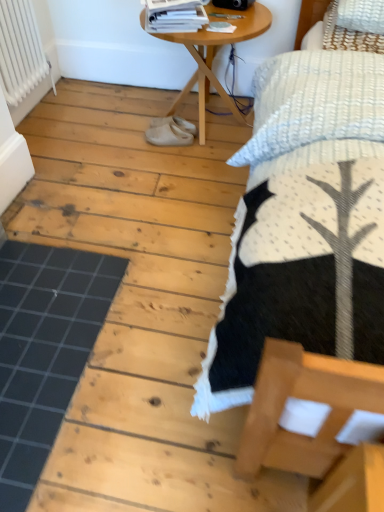
Question: Is wooden table at center to the left or to the right of white glossy magazine at upper center in the image?

Choices:
 (A) right
 (B) left

Answer: (A)

Question: Considering the positions of wooden table at center and white glossy magazine at upper center in the image, is wooden table at center wider or thinner than white glossy magazine at upper center?

Choices:
 (A) wide
 (B) thin

Answer: (A)

Question: Estimate the real-world distances between objects in this image. Which object is farther from the white painted metal radiator at upper left?

Choices:
 (A) white glossy magazine at upper center
 (B) white rubber shoes at center, which is the first footwear in bottom-to-top order
 (C) black rubber mat at lower left
 (D) wooden table at center
 (E) white textured bed at upper right

Answer: (E)

Question: Which object is positioned closest to the white glossy magazine at upper center?

Choices:
 (A) white rubber shoes at center, arranged as the 2th footwear when viewed from the top
 (B) white textured bed at upper right
 (C) white suede shoes at center, placed as the first footwear when sorted from top to bottom
 (D) wooden table at center
 (E) black rubber mat at lower left

Answer: (D)